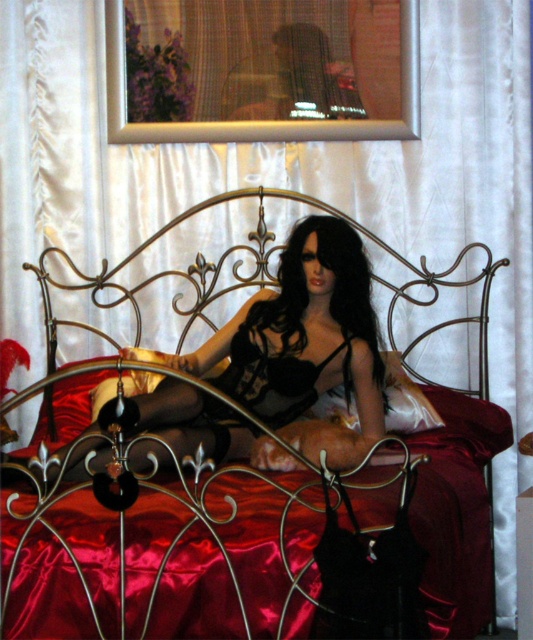
Who is positioned more to the right, satin black lingerie at center or gold wrought iron headboard at center?

Positioned to the right is gold wrought iron headboard at center.

Does satin black lingerie at center have a greater width compared to gold wrought iron headboard at center?

In fact, satin black lingerie at center might be narrower than gold wrought iron headboard at center.

Is point (318, 304) farther from viewer compared to point (100, 278)?

No.

Where is `satin black lingerie at center`? This screenshot has width=533, height=640. satin black lingerie at center is located at coordinates (305, 344).

Is satin black lingerie at center in front of metallic gold bed at center?

Yes, it is in front of metallic gold bed at center.

Can you confirm if satin black lingerie at center is positioned to the right of metallic gold bed at center?

Incorrect, satin black lingerie at center is not on the right side of metallic gold bed at center.

Is point (268, 324) positioned after point (249, 237)?

No, it is in front of (249, 237).

In order to click on satin black lingerie at center in this screenshot , I will do `click(305, 344)`.

Who is positioned more to the left, metallic gold bed at center or gold wrought iron headboard at center?

gold wrought iron headboard at center

Locate an element on the screen. The image size is (533, 640). metallic gold bed at center is located at coordinates (261, 282).